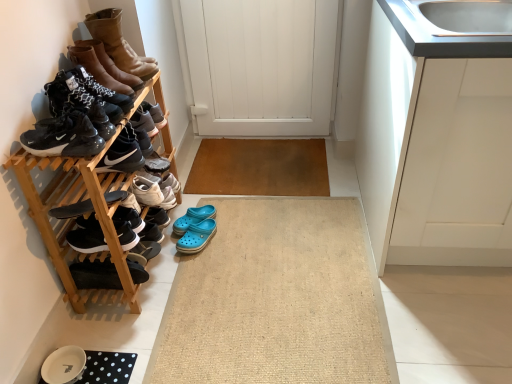
You are a GUI agent. You are given a task and a screenshot of the screen. Output one action in this format:
    pyautogui.click(x=<x>, y=<y>)
    Task: Click on the free space between white wooden door at center and beige woven bath mat at center
    
    Given the screenshot: What is the action you would take?
    pyautogui.click(x=255, y=176)